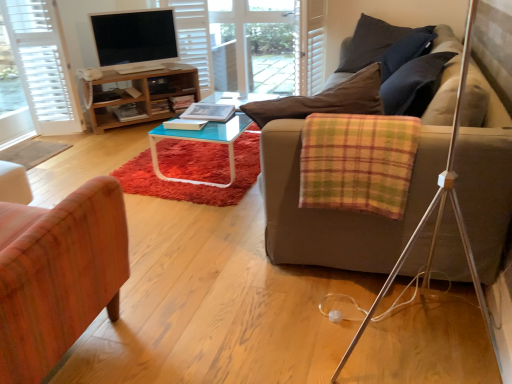
Measure the distance between transparent glass door at center and camera.

transparent glass door at center is 3.87 meters from camera.

Describe the element at coordinates (143, 95) in the screenshot. I see `wooden cabinet at upper left` at that location.

What is the approximate height of wooden cabinet at upper left?

17.57 inches.

Find the location of a particular element. This screenshot has height=384, width=512. matte black tv at upper left is located at coordinates (134, 37).

What are the coordinates of `transparent glass door at center` in the screenshot? It's located at (241, 43).

Who is taller, dark blue fabric pillow at upper right or wooden cabinet at upper left?

With more height is dark blue fabric pillow at upper right.

Find the location of a particular element. pillow above the wooden cabinet at upper left (from a real-world perspective) is located at coordinates (372, 42).

Can you tell me how much dark blue fabric pillow at upper right and wooden cabinet at upper left differ in facing direction?

48.9 degrees.

From the image's perspective, which is above, dark blue fabric pillow at upper right or wooden cabinet at upper left?

From the image's view, dark blue fabric pillow at upper right is above.

Is point (360, 48) positioned after point (108, 197)?

Yes, it is behind point (108, 197).

Looking at this image, is wooden chair at left at the back of dark blue fabric pillow at upper right?

No.

Who is smaller, dark blue fabric pillow at upper right or wooden chair at left?

With smaller size is dark blue fabric pillow at upper right.

Between dark blue fabric pillow at upper right and wooden chair at left, which one has larger width?

With larger width is wooden chair at left.

Consider the image. From a real-world perspective, does white textured door at left stand above dark blue fabric pillow at upper right?

Incorrect, from a real-world perspective, white textured door at left is lower than dark blue fabric pillow at upper right.

Image resolution: width=512 pixels, height=384 pixels. In order to click on curtain beneath the dark blue fabric pillow at upper right (from a real-world perspective) in this screenshot , I will do `click(41, 61)`.

Which is closer, (60, 76) or (362, 60)?

Point (60, 76).

Can you confirm if white textured door at left is positioned to the right of dark blue fabric pillow at upper right?

No, white textured door at left is not to the right of dark blue fabric pillow at upper right.

Is hardcover book at center, which is the 2th book from front to back, not close to wooden chair at left?

Indeed, hardcover book at center, which is the 2th book from front to back, is not near wooden chair at left.

Looking at this image, is hardcover book at center, acting as the first book starting from the back, wider or thinner than wooden chair at left?

Clearly, hardcover book at center, acting as the first book starting from the back, has less width compared to wooden chair at left.

Which object is more forward, hardcover book at center, which is the 2th book from front to back, or wooden chair at left?

wooden chair at left is closer to the camera.

The image size is (512, 384). Find the location of `chair that is on the left side of hardcover book at center, acting as the first book starting from the back`. chair that is on the left side of hardcover book at center, acting as the first book starting from the back is located at coordinates 58,275.

Looking at this image, does white textured door at left have a lesser width compared to wooden cabinet at upper left?

Yes, white textured door at left is thinner than wooden cabinet at upper left.

From the image's perspective, is white textured door at left over wooden cabinet at upper left?

Yes, from the image's perspective, white textured door at left is over wooden cabinet at upper left.

Is the surface of white textured door at left in direct contact with wooden cabinet at upper left?

No.

Is white textured door at left bigger or smaller than wooden cabinet at upper left?

In the image, white textured door at left appears to be smaller than wooden cabinet at upper left.

Is hardcover book at center, arranged as the first book when viewed from the front, facing towards dark blue fabric pillow at upper right?

No, hardcover book at center, arranged as the first book when viewed from the front, does not turn towards dark blue fabric pillow at upper right.

Considering the sizes of objects hardcover book at center, arranged as the first book when viewed from the front, and dark blue fabric pillow at upper right in the image provided, who is thinner, hardcover book at center, arranged as the first book when viewed from the front, or dark blue fabric pillow at upper right?

Thinner between the two is hardcover book at center, arranged as the first book when viewed from the front.

Considering the relative positions of hardcover book at center, which is the second book from back to front, and dark blue fabric pillow at upper right in the image provided, is hardcover book at center, which is the second book from back to front, to the left or to the right of dark blue fabric pillow at upper right?

In the image, hardcover book at center, which is the second book from back to front, appears on the left side of dark blue fabric pillow at upper right.

From the picture: How different are the orientations of hardcover book at center, arranged as the first book when viewed from the front, and plaid fabric blanket at right in degrees?

The facing directions of hardcover book at center, arranged as the first book when viewed from the front, and plaid fabric blanket at right are 93.9 degrees apart.

Considering the relative sizes of hardcover book at center, arranged as the first book when viewed from the front, and plaid fabric blanket at right in the image provided, is hardcover book at center, arranged as the first book when viewed from the front, wider than plaid fabric blanket at right?

No.

Can you confirm if hardcover book at center, arranged as the first book when viewed from the front, is bigger than plaid fabric blanket at right?

No.

The height and width of the screenshot is (384, 512). Identify the location of cabinetry behind the dark blue fabric pillow at upper right. (143, 95).

Find the location of a particular element. The width and height of the screenshot is (512, 384). chair in front of the dark blue fabric pillow at upper right is located at coordinates (58, 275).

Considering their positions, is hardcover book at center, acting as the first book starting from the back, positioned closer to white textured door at left than wooden chair at left?

hardcover book at center, acting as the first book starting from the back, is closer to white textured door at left.

When comparing their distances from transparent glass door at center, does white textured door at left or wooden cabinet at upper left seem further?

white textured door at left is further to transparent glass door at center.

Which object lies nearer to the anchor point dark blue fabric pillow at upper right, white textured door at left or plaid fabric blanket at right?

plaid fabric blanket at right.

From the image, which object appears to be nearer to wooden cabinet at upper left, matte black tv at upper left or white textured door at left?

matte black tv at upper left is positioned closer to the anchor wooden cabinet at upper left.

Based on their spatial positions, is transparent glass door at center or white textured door at left closer to wooden cabinet at upper left?

white textured door at left lies closer to wooden cabinet at upper left than the other object.

In the scene shown: Estimate the real-world distances between objects in this image. Which object is closer to transparent glass door at center, wooden chair at left or white textured door at left?

white textured door at left is closer to transparent glass door at center.

Considering their positions, is wooden chair at left positioned closer to hardcover book at center, acting as the first book starting from the back, than white textured door at left?

white textured door at left.

From the image, which object appears to be nearer to white textured door at left, dark blue fabric pillow at upper right or hardcover book at center, which is the 2th book from front to back?

hardcover book at center, which is the 2th book from front to back, is positioned closer to the anchor white textured door at left.

At what (x,y) coordinates should I click in order to perform the action: click on glass door between matte black tv at upper left and dark blue fabric pillow at upper right from left to right. Please return your answer as a coordinate pair (x, y). The width and height of the screenshot is (512, 384). Looking at the image, I should click on (241, 43).

Identify the location of book between white textured door at left and hardcover book at center, acting as the first book starting from the back, in the horizontal direction. (184, 124).

Where is `glass door situated between hardcover book at center, arranged as the first book when viewed from the front, and dark blue fabric pillow at upper right from left to right`? Image resolution: width=512 pixels, height=384 pixels. glass door situated between hardcover book at center, arranged as the first book when viewed from the front, and dark blue fabric pillow at upper right from left to right is located at coordinates (241, 43).

Locate an element on the screen. The height and width of the screenshot is (384, 512). curtain located between plaid fabric blanket at right and matte black tv at upper left in the depth direction is located at coordinates (41, 61).